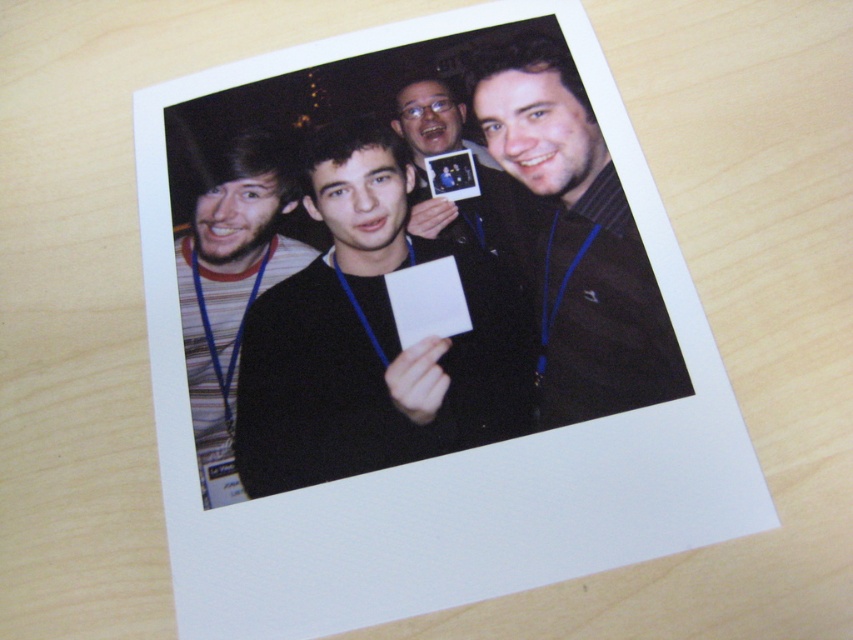
Question: Which is nearer to the matte black photo frame at center?

Choices:
 (A) black matte jacket at center
 (B) striped fabric shirt at left

Answer: (A)

Question: Is black matte jacket at center thinner than striped fabric shirt at left?

Choices:
 (A) yes
 (B) no

Answer: (B)

Question: Which object is positioned closest to the black matte jacket at center?

Choices:
 (A) matte black photo frame at center
 (B) black matte sweater at center

Answer: (A)

Question: Considering the real-world distances, which object is farthest from the matte black photo frame at center?

Choices:
 (A) black matte sweater at center
 (B) striped fabric shirt at left

Answer: (B)

Question: Can you confirm if striped fabric shirt at left is positioned to the left of matte black photo frame at center?

Choices:
 (A) yes
 (B) no

Answer: (A)

Question: Can you confirm if black matte sweater at center is thinner than striped fabric shirt at left?

Choices:
 (A) no
 (B) yes

Answer: (A)